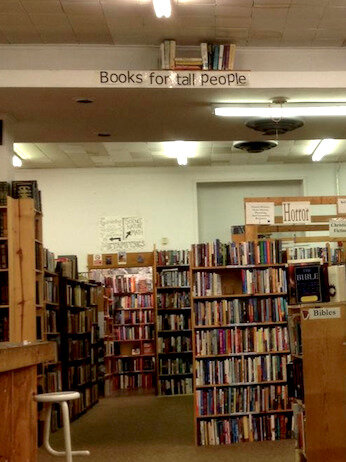
Find the location of a particular element. The image size is (346, 462). wall is located at coordinates 172,196, 78,201, 65,228.